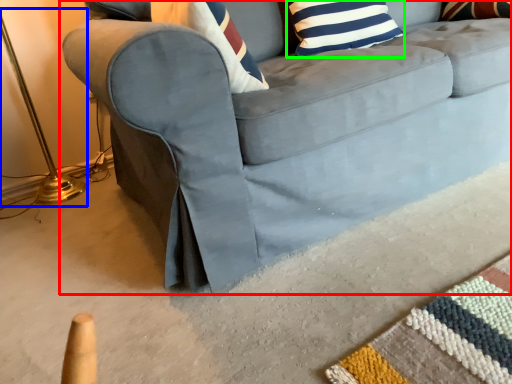
Question: Which object is the closest to the studio couch (highlighted by a red box)? Choose among these: table lamp (highlighted by a blue box) or pillow (highlighted by a green box).

Choices:
 (A) table lamp
 (B) pillow

Answer: (B)